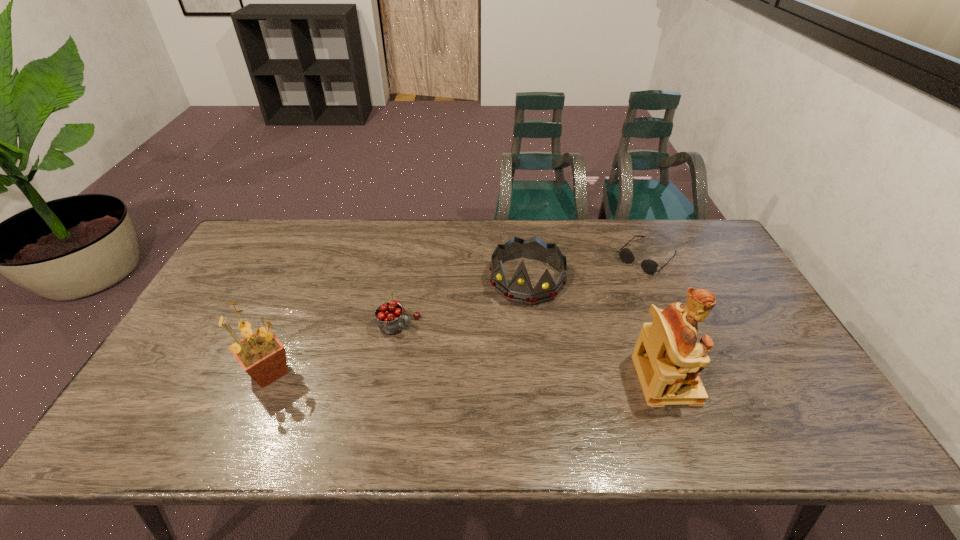
Identify the location of free spot located 0.310m on the front-facing side of the shortest object. This screenshot has width=960, height=540. (575, 326).

At what (x,y) coordinates should I click in order to perform the action: click on free spot located 0.240m on the front-facing side of the shortest object. Please return your answer as a coordinate pair (x, y). This screenshot has width=960, height=540. Looking at the image, I should click on (588, 313).

This screenshot has width=960, height=540. In order to click on vacant space located at the front of the tiara with jewels in this screenshot , I will do `click(513, 326)`.

The image size is (960, 540). What are the coordinates of `vacant space positioned at the front of the tiara with jewels` in the screenshot? It's located at (513, 326).

This screenshot has height=540, width=960. Identify the location of vacant area located at the front of the tiara with jewels. (501, 362).

The height and width of the screenshot is (540, 960). Identify the location of free space located 0.400m on the handle side of the fourth tallest object. (546, 402).

Locate an element on the screen. The image size is (960, 540). vacant area situated 0.180m on the handle side of the fourth tallest object is located at coordinates (469, 362).

The height and width of the screenshot is (540, 960). What are the coordinates of `vacant space situated 0.260m on the handle side of the fourth tallest object` in the screenshot? It's located at (496, 376).

Where is `sunglasses that is at the far edge`? This screenshot has width=960, height=540. sunglasses that is at the far edge is located at coordinates (649, 266).

Identify the location of tiara located in the far edge section of the desktop. This screenshot has height=540, width=960. (520, 289).